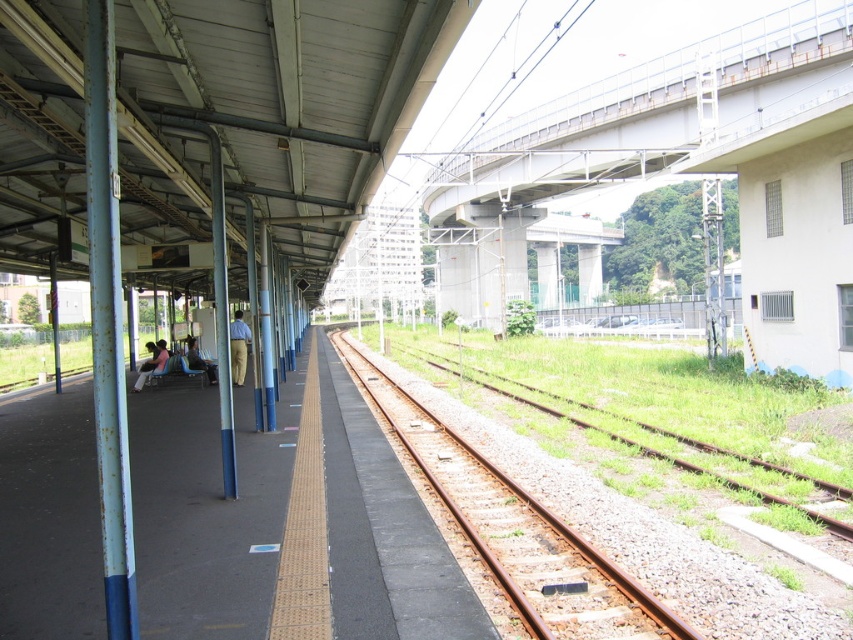
Question: In this image, where is pink fabric chair at left located relative to light brown fabric chair at left?

Choices:
 (A) above
 (B) below

Answer: (B)

Question: Which of the following is the closest to the observer?

Choices:
 (A) (456, 520)
 (B) (236, 323)
 (C) (720, 477)

Answer: (A)

Question: Can you confirm if pink fabric chair at left is bigger than light brown fabric chair at left?

Choices:
 (A) no
 (B) yes

Answer: (B)

Question: Which of the following is the closest to the observer?

Choices:
 (A) (190, 339)
 (B) (239, 326)

Answer: (B)

Question: Among these objects, which one is farthest from the camera?

Choices:
 (A) light brown fabric pants at center
 (B) brown gravel train track at center
 (C) light brown fabric chair at left

Answer: (C)

Question: Does brown gravel train track at center appear on the right side of light brown fabric pants at center?

Choices:
 (A) no
 (B) yes

Answer: (B)